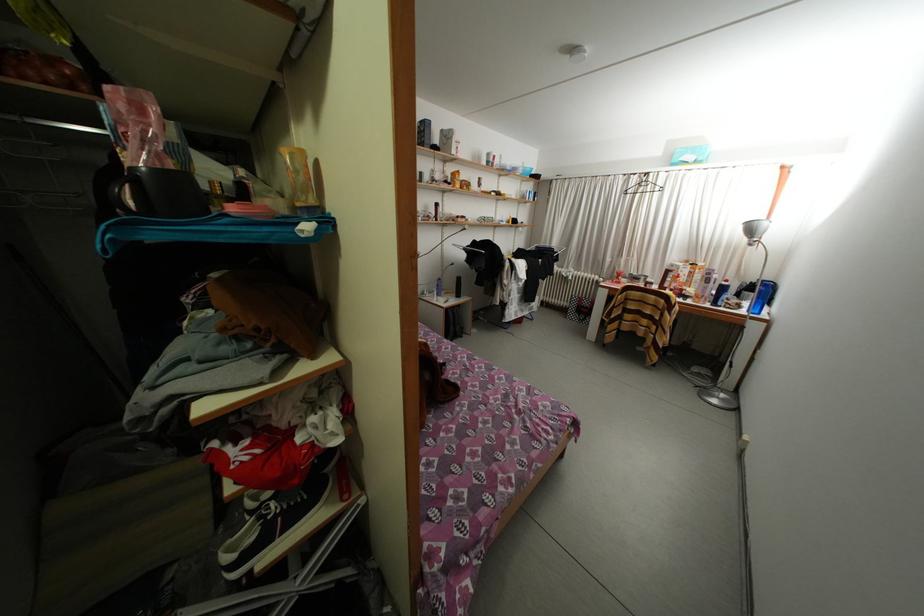
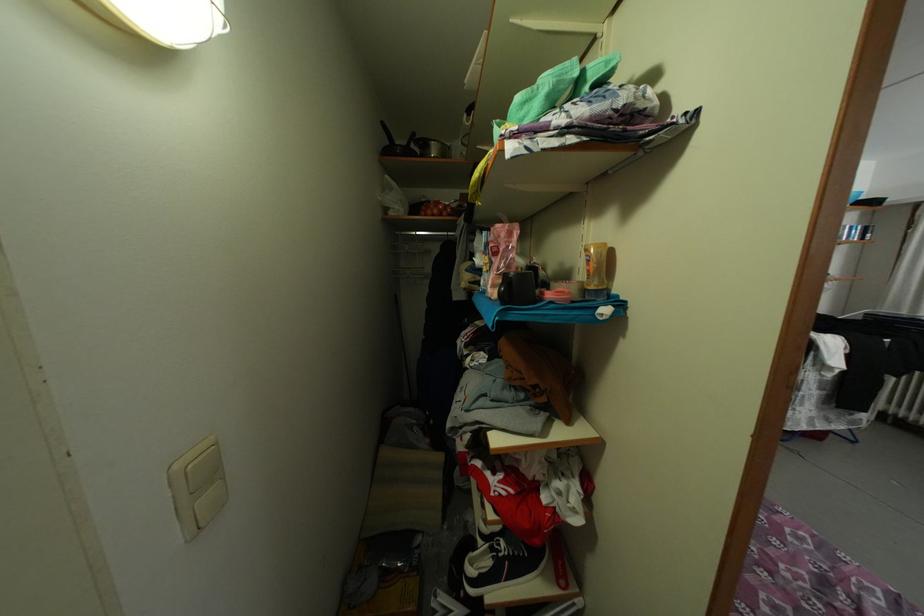
Where in the second image is the point corresponding to point (268, 523) from the first image?

(500, 554)